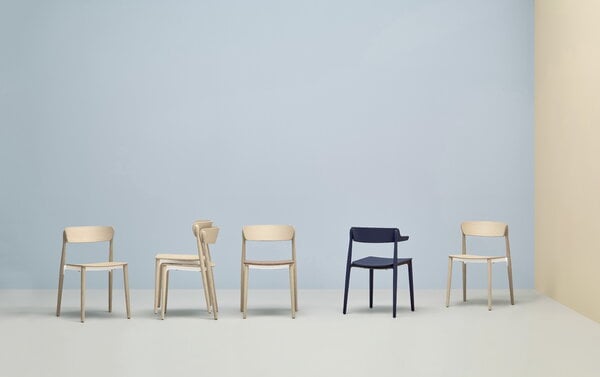
Image resolution: width=600 pixels, height=377 pixels. I want to click on wall, so click(227, 79).